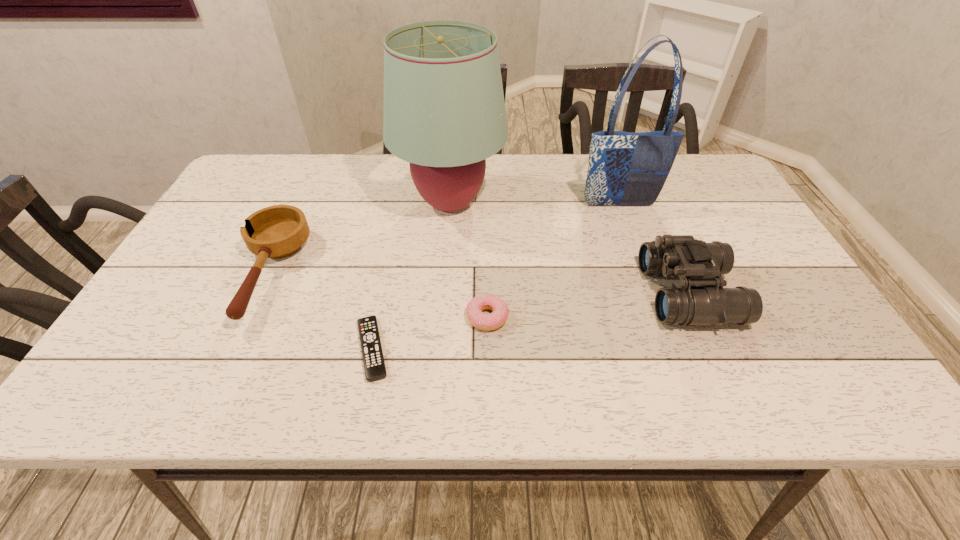
Where is `vacant space situated 0.270m through the lenses of the fourth shortest object`? vacant space situated 0.270m through the lenses of the fourth shortest object is located at coordinates pos(529,293).

At what (x,y) coordinates should I click in order to perform the action: click on free space located 0.230m through the lenses of the fourth shortest object. Please return your answer as a coordinate pair (x, y). This screenshot has width=960, height=540. Looking at the image, I should click on pyautogui.click(x=547, y=293).

Locate an element on the screen. vacant point located 0.070m with the handle on the side of the third shortest object is located at coordinates (228, 360).

Locate an element on the screen. vacant space located 0.190m on the left of the second shortest object is located at coordinates coord(379,318).

In order to click on free space located on the back of the remote control in this screenshot , I will do `click(397, 225)`.

Where is `object at the far edge`? object at the far edge is located at coordinates (444, 112).

Identify the location of object present at the near edge. The height and width of the screenshot is (540, 960). (374, 366).

Find the location of `object located in the left edge section of the desktop`. object located in the left edge section of the desktop is located at coordinates (279, 231).

Locate an element on the screen. The height and width of the screenshot is (540, 960). object that is at the right edge is located at coordinates (701, 300).

Find the location of a particular element. The image size is (960, 540). free space at the left edge is located at coordinates (193, 293).